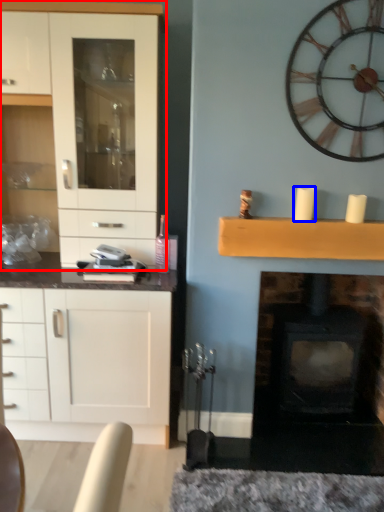
Question: Which point is closer to the camera, cabinetry (highlighted by a red box) or candle (highlighted by a blue box)?

Choices:
 (A) cabinetry
 (B) candle

Answer: (A)